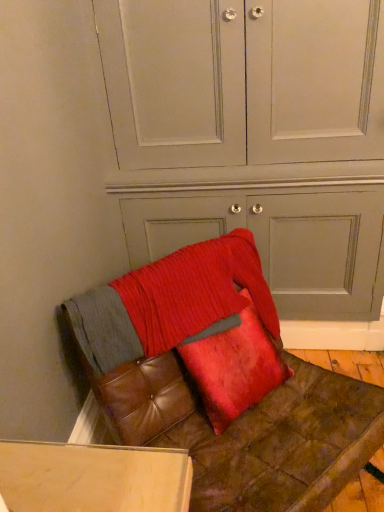
Question: Would you say matte gray dresser at center contains velvet red pillow at center?

Choices:
 (A) yes
 (B) no

Answer: (B)

Question: From a real-world perspective, is matte gray dresser at center positioned under velvet red pillow at center based on gravity?

Choices:
 (A) no
 (B) yes

Answer: (A)

Question: Is matte gray dresser at center further to the viewer compared to velvet red pillow at center?

Choices:
 (A) no
 (B) yes

Answer: (B)

Question: From the image's perspective, is matte gray dresser at center below velvet red pillow at center?

Choices:
 (A) no
 (B) yes

Answer: (A)

Question: Is matte gray dresser at center turned away from velvet red pillow at center?

Choices:
 (A) no
 (B) yes

Answer: (B)

Question: Is matte gray dresser at center at the right side of velvet red pillow at center?

Choices:
 (A) yes
 (B) no

Answer: (A)

Question: From a real-world perspective, is velvet red pillow at center positioned under matte gray dresser at center based on gravity?

Choices:
 (A) no
 (B) yes

Answer: (B)

Question: Considering the relative sizes of velvet red pillow at center and matte gray dresser at center in the image provided, is velvet red pillow at center wider than matte gray dresser at center?

Choices:
 (A) yes
 (B) no

Answer: (B)

Question: Considering the relative positions of velvet red pillow at center and matte gray dresser at center in the image provided, is velvet red pillow at center behind matte gray dresser at center?

Choices:
 (A) yes
 (B) no

Answer: (B)

Question: Is velvet red pillow at center to the left of matte gray dresser at center from the viewer's perspective?

Choices:
 (A) no
 (B) yes

Answer: (B)

Question: Considering the relative sizes of velvet red pillow at center and matte gray dresser at center in the image provided, is velvet red pillow at center smaller than matte gray dresser at center?

Choices:
 (A) no
 (B) yes

Answer: (B)

Question: Considering the relative sizes of velvet red pillow at center and matte gray dresser at center in the image provided, is velvet red pillow at center bigger than matte gray dresser at center?

Choices:
 (A) yes
 (B) no

Answer: (B)

Question: Considering the relative positions of leather cushion at lower right and velvet red pillow at center in the image provided, is leather cushion at lower right to the left of velvet red pillow at center from the viewer's perspective?

Choices:
 (A) no
 (B) yes

Answer: (A)